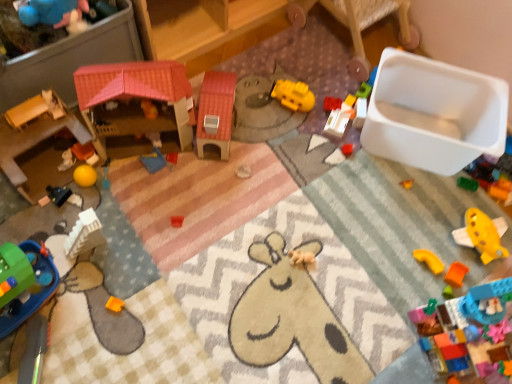
Where is `vacant space that's between black plastic toy at lower left, the 13th toy from the right, and white plastic container at center, marked as the 6th toy in a right-to-left arrangement`? The image size is (512, 384). vacant space that's between black plastic toy at lower left, the 13th toy from the right, and white plastic container at center, marked as the 6th toy in a right-to-left arrangement is located at coordinates (x=226, y=157).